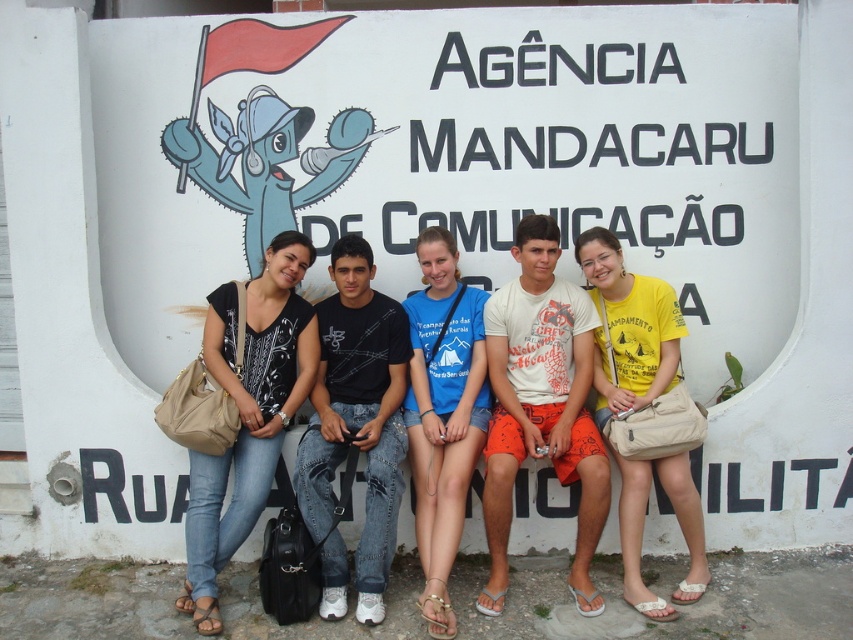
You are standing 3 meters away from the black cotton shirt at center. Can you reach it without moving closer?

The black cotton shirt at center is 4.00 meters away from the viewer. Since you are standing 3 meters away, you are closer than the shirt, so you can reach it.

Based on the photo, based on the scene description, where is the orange cotton shorts at center located in terms of coordinates?

The orange cotton shorts at center is located at coordinates point [541,404].